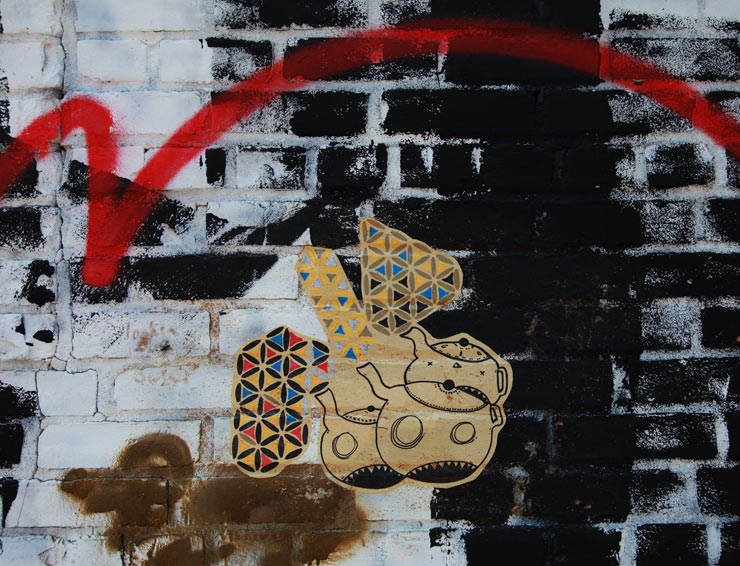
Identify the location of red paint. (109, 222).